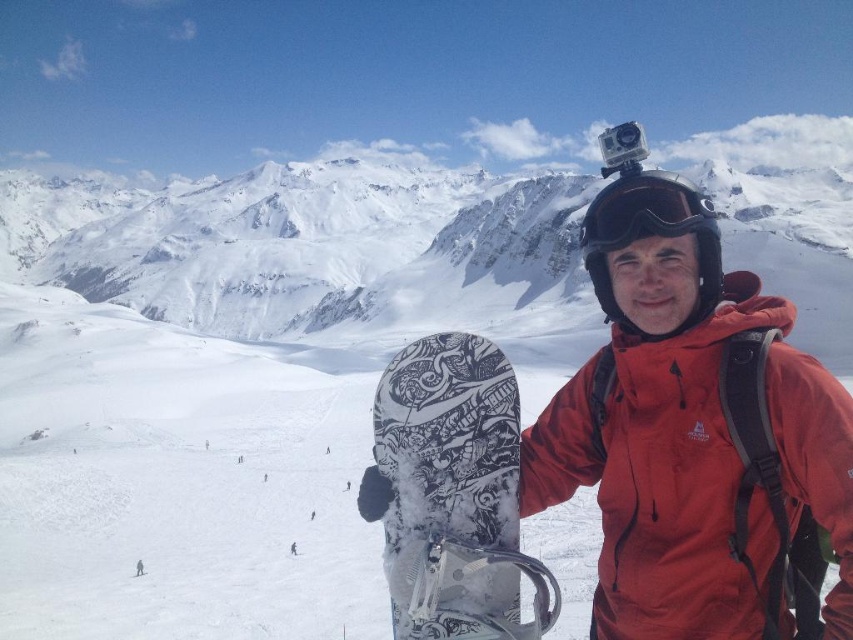
You are a photographer planning to take a closeup shot of the white matte snowboard at center and the black matte goggles at center. Which object should you focus on first if you want to capture both in focus without moving the camera?

The white matte snowboard at center is located below the black matte goggles at center. Since they are at different heights, focusing on the black matte goggles at center first would ensure both are in focus as they are closer to the camera.

You are a photographer planning to capture a wide shot of the snowy mountain landscape. You need to ensure that both the white matte snowboard at center and the black matte goggles at center are in focus simultaneously. Given that your camera has a depth of field range of 12 meters, will you be able to achieve this?

The distance between the white matte snowboard at center and the black matte goggles at center is 13.12 meters. Since the depth of field range of your camera is 12 meters, which is shorter than the required distance, you will not be able to have both objects in focus simultaneously.

You are a photographer planning to take a photo of the white matte snowboard at center from your current position. The camera you are using has a maximum focus range of 30 meters. Will the snowboard be in focus?

The white matte snowboard at center is 36.43 meters from the camera, which exceeds the maximum focus range of 30 meters. Therefore, the snowboard will not be in focus.